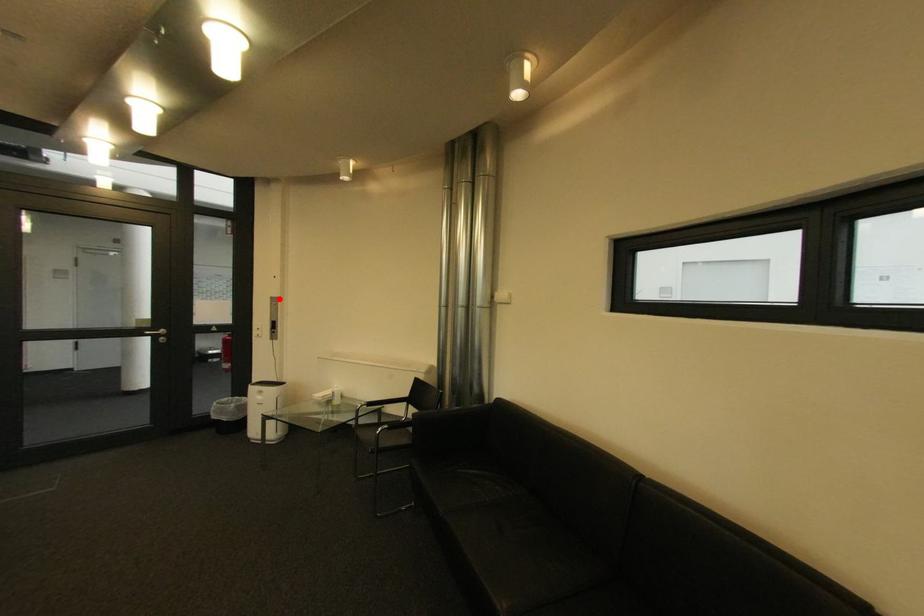
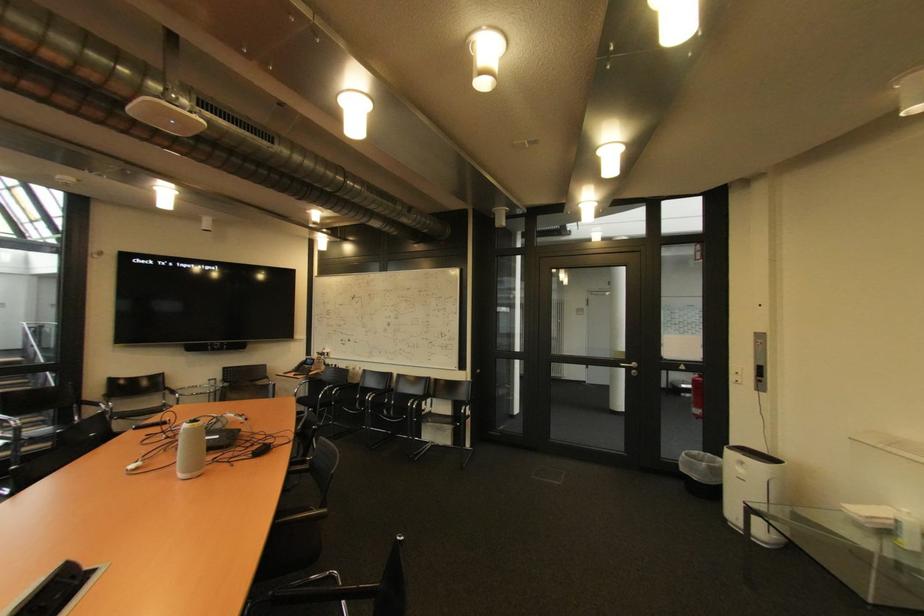
In the second image, find the point that corresponds to the highlighted location in the first image.

(763, 334)